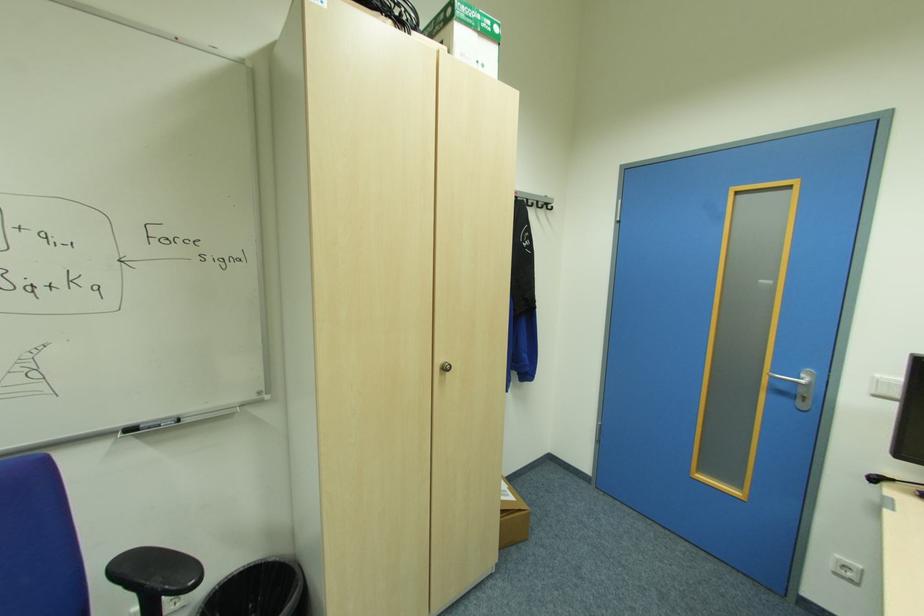
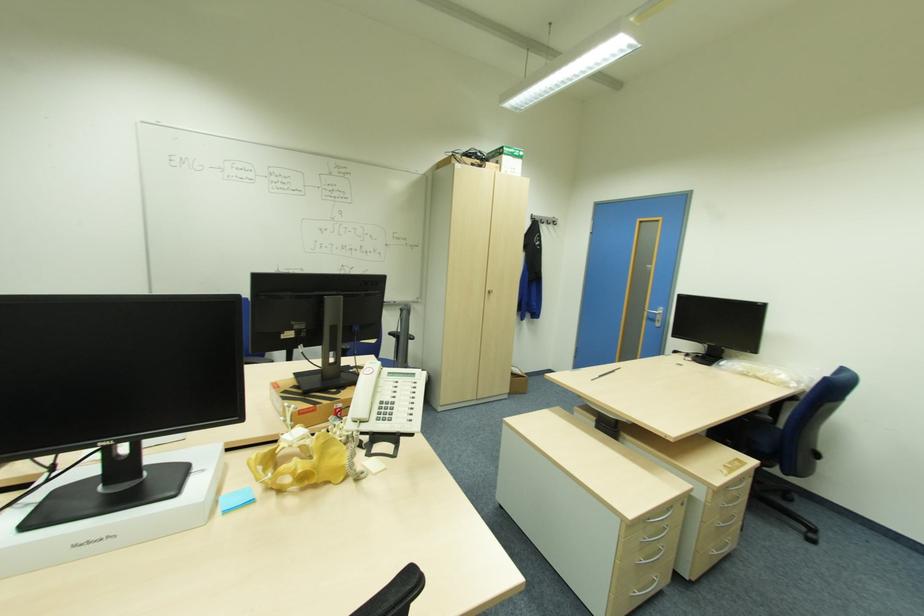
Question: In a continuous first-person perspective shot, in which direction is the camera moving?

Choices:
 (A) Left
 (B) Right
 (C) Forward
 (D) Backward

Answer: (D)